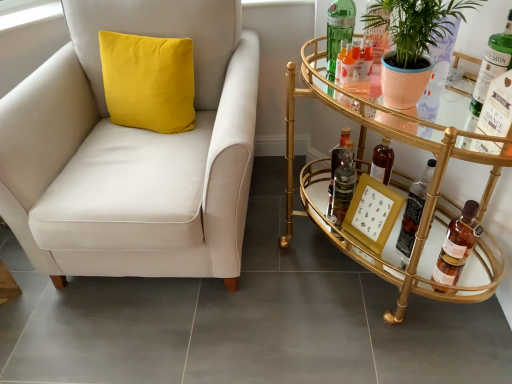
Question: From a real-world perspective, is matte peach pot at right on top of translucent glass bottle at lower right, which is the fourth bottle from left to right?

Choices:
 (A) no
 (B) yes

Answer: (B)

Question: From a real-world perspective, is matte peach pot at right physically below translucent glass bottle at lower right, which is the fourth bottle from left to right?

Choices:
 (A) no
 (B) yes

Answer: (A)

Question: Does matte peach pot at right come in front of translucent glass bottle at lower right, arranged as the 3th bottle when viewed from the right?

Choices:
 (A) no
 (B) yes

Answer: (B)

Question: From the image's perspective, would you say matte peach pot at right is positioned over translucent glass bottle at lower right, arranged as the 3th bottle when viewed from the right?

Choices:
 (A) yes
 (B) no

Answer: (A)

Question: Is matte peach pot at right facing towards translucent glass bottle at lower right, which is the fourth bottle from left to right?

Choices:
 (A) yes
 (B) no

Answer: (B)

Question: From the image's perspective, is green glass bottle at upper right, acting as the 5th bottle starting from the left, located above or below gold mirrored bar cart at right?

Choices:
 (A) above
 (B) below

Answer: (A)

Question: Considering the relative positions of green glass bottle at upper right, acting as the 5th bottle starting from the left, and gold mirrored bar cart at right in the image provided, is green glass bottle at upper right, acting as the 5th bottle starting from the left, to the left or to the right of gold mirrored bar cart at right?

Choices:
 (A) right
 (B) left

Answer: (A)

Question: In terms of width, does green glass bottle at upper right, acting as the 2th bottle starting from the right, look wider or thinner when compared to gold mirrored bar cart at right?

Choices:
 (A) wide
 (B) thin

Answer: (B)

Question: Which is correct: green glass bottle at upper right, acting as the 5th bottle starting from the left, is inside gold mirrored bar cart at right, or outside of it?

Choices:
 (A) inside
 (B) outside

Answer: (A)

Question: Looking at the image, does green glass bottle at upper right, which is the first bottle in left-to-right order, seem bigger or smaller compared to green glass bottle at upper right, acting as the 5th bottle starting from the left?

Choices:
 (A) small
 (B) big

Answer: (B)

Question: Is green glass bottle at upper right, which is the first bottle in left-to-right order, taller or shorter than green glass bottle at upper right, acting as the 2th bottle starting from the right?

Choices:
 (A) tall
 (B) short

Answer: (A)

Question: Would you say green glass bottle at upper right, which is the first bottle in left-to-right order, is inside or outside green glass bottle at upper right, acting as the 2th bottle starting from the right?

Choices:
 (A) outside
 (B) inside

Answer: (A)

Question: Is point (349, 6) closer or farther from the camera than point (489, 51)?

Choices:
 (A) farther
 (B) closer

Answer: (A)

Question: Is point (506, 23) closer or farther from the camera than point (331, 178)?

Choices:
 (A) closer
 (B) farther

Answer: (A)

Question: Considering the positions of green glass bottle at upper right, acting as the 5th bottle starting from the left, and translucent glass bottle at center in the image, is green glass bottle at upper right, acting as the 5th bottle starting from the left, wider or thinner than translucent glass bottle at center?

Choices:
 (A) thin
 (B) wide

Answer: (A)